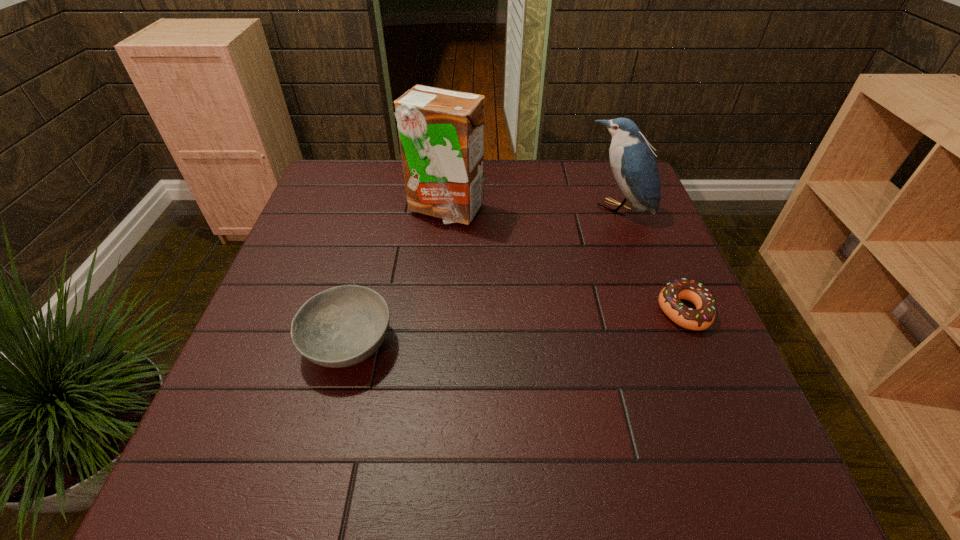
Locate an element on the screen. vacant space that is in between the shortest object and the tallest object is located at coordinates (564, 260).

Identify the location of vacant space that is in between the shortest object and the third tallest object. This screenshot has width=960, height=540. (516, 327).

This screenshot has height=540, width=960. Identify the location of vacant area that lies between the bird and the carton. pyautogui.click(x=532, y=209).

Locate an element on the screen. The height and width of the screenshot is (540, 960). vacant area between the carton and the bowl is located at coordinates (396, 276).

Identify the location of object that is the closest to the second tallest object. (701, 318).

Locate an element on the screen. This screenshot has height=540, width=960. the second closest object relative to the third shortest object is located at coordinates (441, 132).

Identify the location of free space that satisfies the following two spatial constraints: 1. on the back side of the third tallest object; 2. on the right side of the second tallest object. This screenshot has height=540, width=960. (383, 209).

I want to click on vacant space that satisfies the following two spatial constraints: 1. on the front side of the bird; 2. on the left side of the shortest object, so click(656, 312).

At what (x,y) coordinates should I click in order to perform the action: click on vacant space that satisfies the following two spatial constraints: 1. on the back side of the bird; 2. on the right side of the bowl. Please return your answer as a coordinate pair (x, y). The height and width of the screenshot is (540, 960). Looking at the image, I should click on (383, 209).